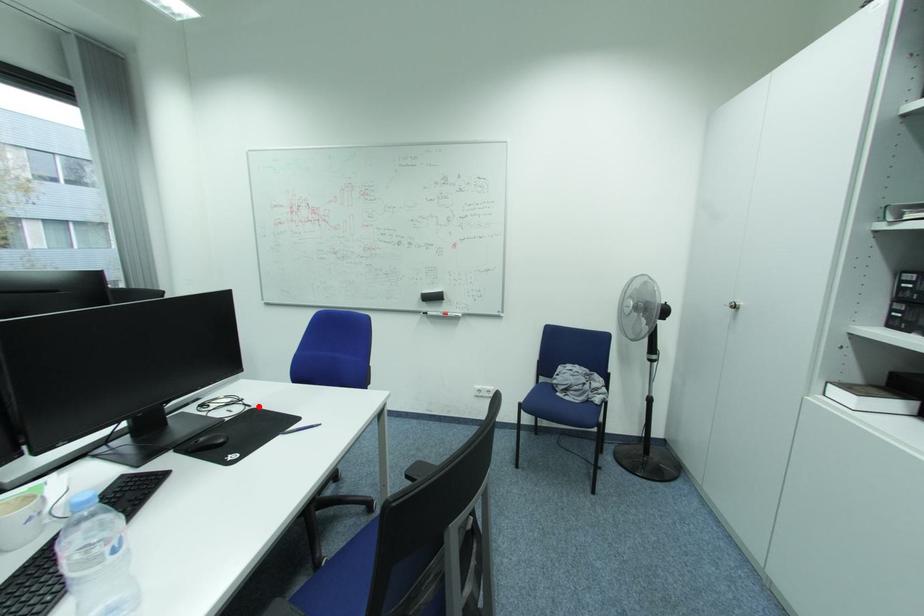
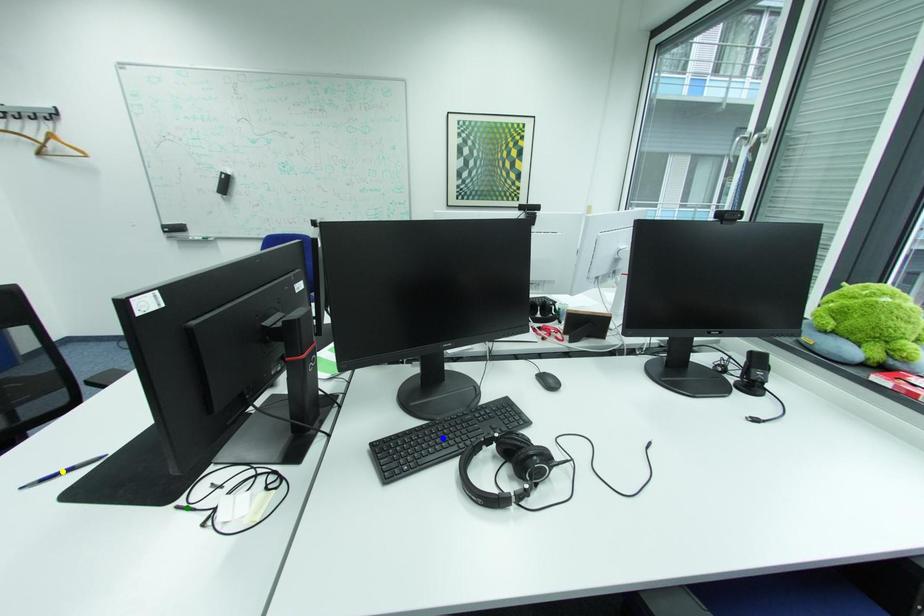
Question: I am providing you with two images of the same scene from different viewpoints. A red point is marked on the first image. You are given multiple points on the second image. Which mark in image 2 goes with the point in image 1?

Choices:
 (A) green point
 (B) yellow point
 (C) blue point

Answer: (A)